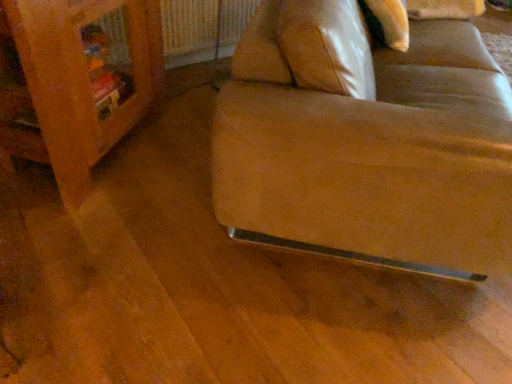
Question: Based on their sizes in the image, would you say metallic silver radiator at upper center is bigger or smaller than leather at lower right?

Choices:
 (A) big
 (B) small

Answer: (B)

Question: Is metallic silver radiator at upper center inside the boundaries of leather at lower right, or outside?

Choices:
 (A) outside
 (B) inside

Answer: (A)

Question: Estimate the real-world distances between objects in this image. Which object is closer to the metallic silver radiator at upper center?

Choices:
 (A) leather at lower right
 (B) wooden bookshelf at left

Answer: (B)

Question: Which object is positioned farthest from the metallic silver radiator at upper center?

Choices:
 (A) leather at lower right
 (B) wooden bookshelf at left

Answer: (A)